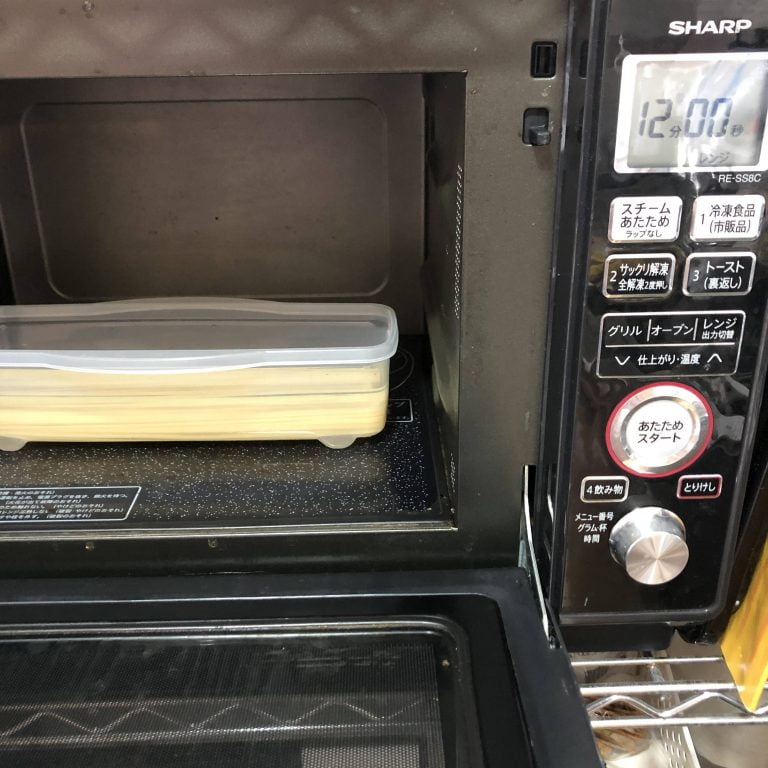
Identify the location of oven panel button. This screenshot has width=768, height=768. [x=680, y=346], [x=641, y=276], [x=727, y=273], [x=732, y=223], [x=644, y=220], [x=659, y=439].